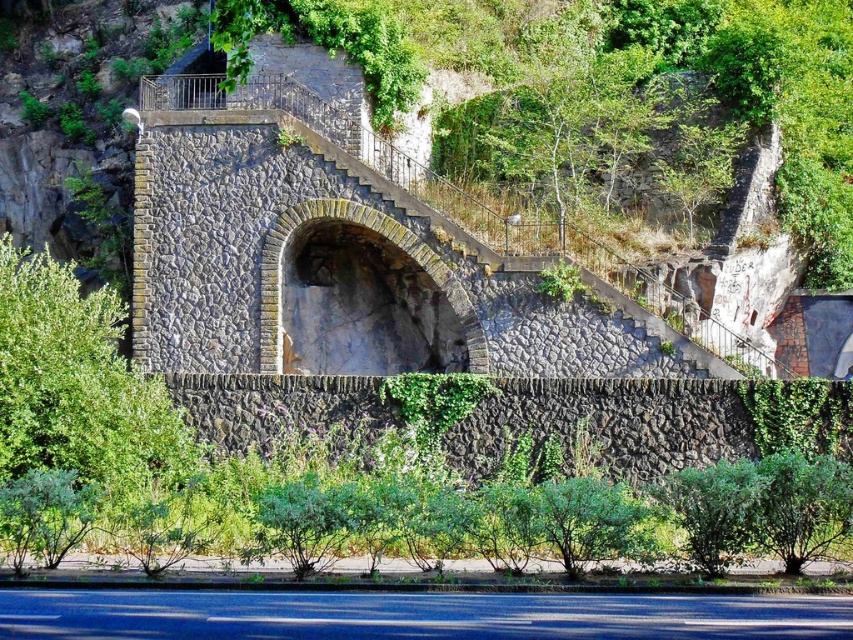
Question: Which point is closer to the camera?

Choices:
 (A) green leafy bush at lower right
 (B) green leafy bush at lower left

Answer: (A)

Question: Is green leafy bush at lower left behind green leafy bush at lower right?

Choices:
 (A) yes
 (B) no

Answer: (A)

Question: Is green leafy bush at lower left thinner than green leafy bush at lower right?

Choices:
 (A) no
 (B) yes

Answer: (A)

Question: Which point appears farthest from the camera in this image?

Choices:
 (A) (55, 346)
 (B) (798, 481)

Answer: (A)

Question: Among these objects, which one is farthest from the camera?

Choices:
 (A) green leafy bush at lower right
 (B) green leafy bush at lower left

Answer: (B)

Question: Can you confirm if green leafy bush at lower left is positioned below green leafy bush at lower right?

Choices:
 (A) no
 (B) yes

Answer: (A)